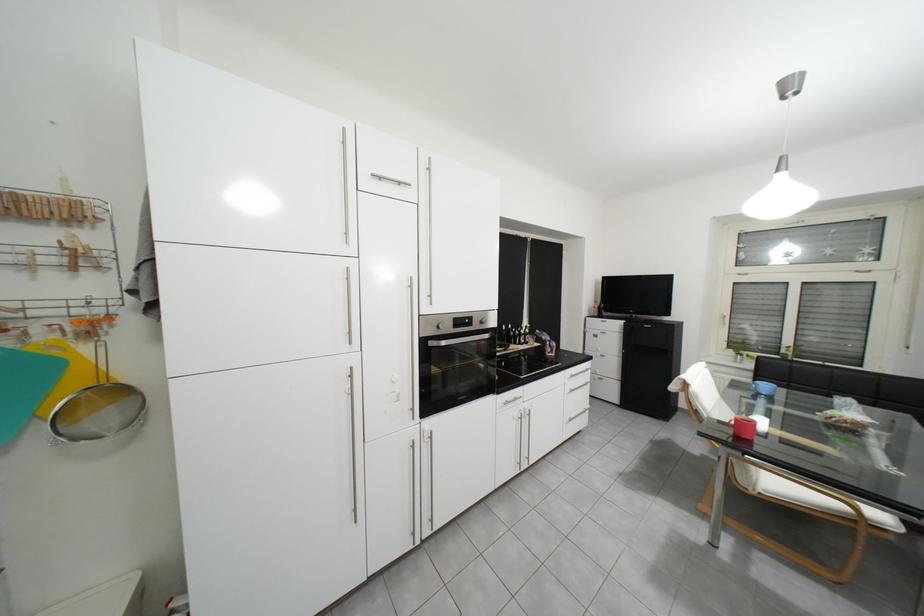
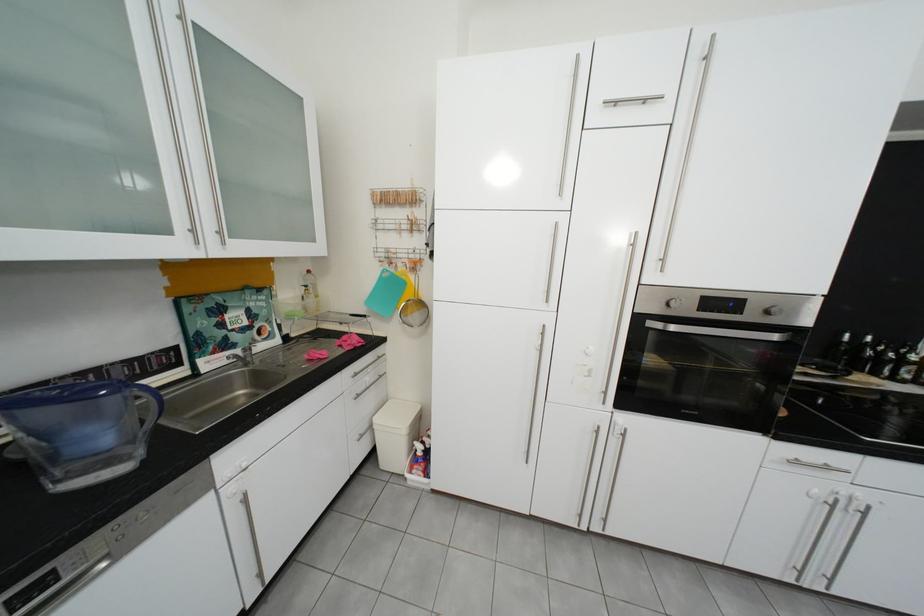
The point at (493,323) is marked in the first image. Where is the corresponding point in the second image?

(779, 314)